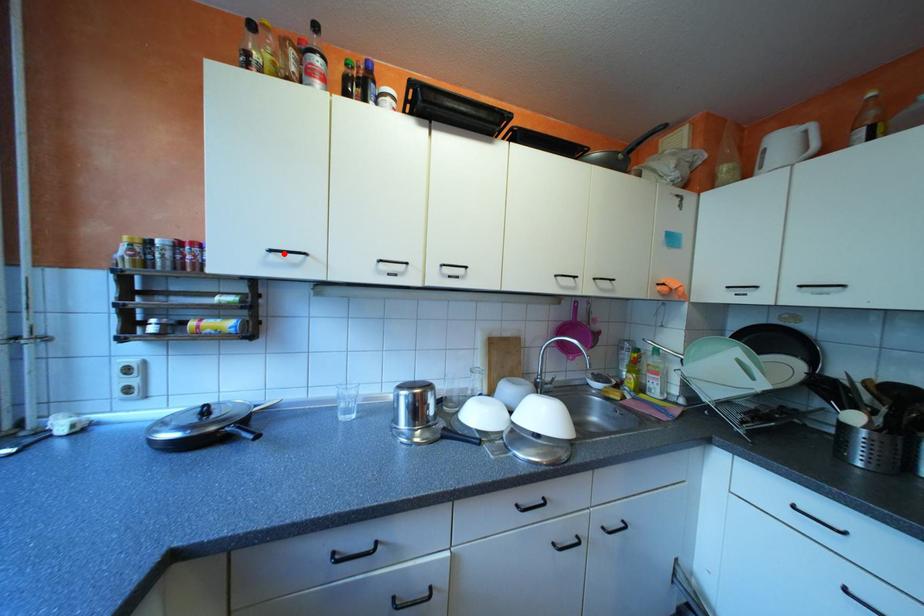
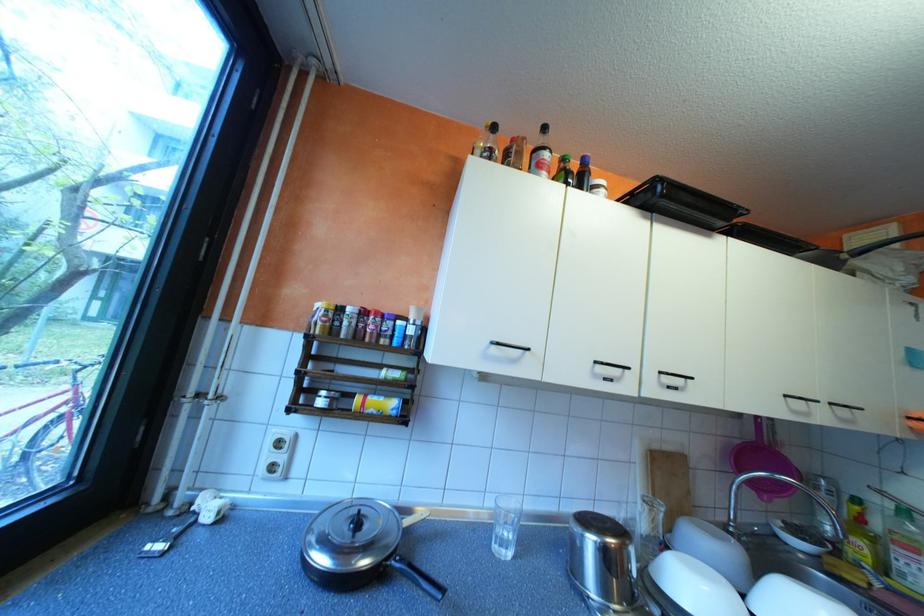
Find the pixel in the second image that matches the highlighted location in the first image.

(505, 346)